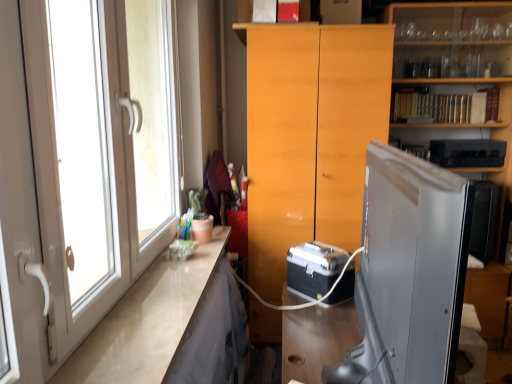
Question: Is metallic silver briefcase at center, which is counted as the 1th appliance, starting from the left, next to white glossy counter top at left?

Choices:
 (A) no
 (B) yes

Answer: (A)

Question: Is metallic silver briefcase at center, the second appliance from the back, aimed at white glossy counter top at left?

Choices:
 (A) no
 (B) yes

Answer: (A)

Question: Considering the relative sizes of metallic silver briefcase at center, acting as the 1th appliance starting from the front, and white glossy counter top at left in the image provided, is metallic silver briefcase at center, acting as the 1th appliance starting from the front, shorter than white glossy counter top at left?

Choices:
 (A) no
 (B) yes

Answer: (A)

Question: Can you confirm if metallic silver briefcase at center, acting as the 1th appliance starting from the front, is positioned to the left of white glossy counter top at left?

Choices:
 (A) no
 (B) yes

Answer: (A)

Question: From a real-world perspective, is metallic silver briefcase at center, the second appliance viewed from the right, physically above white glossy counter top at left?

Choices:
 (A) yes
 (B) no

Answer: (B)

Question: Considering the positions of light wood cabinet at center and white glossy door at left in the image, is light wood cabinet at center wider or thinner than white glossy door at left?

Choices:
 (A) thin
 (B) wide

Answer: (B)

Question: Considering their positions, is light wood cabinet at center located in front of or behind white glossy door at left?

Choices:
 (A) behind
 (B) front

Answer: (A)

Question: Is light wood cabinet at center bigger or smaller than white glossy door at left?

Choices:
 (A) big
 (B) small

Answer: (A)

Question: Do you think light wood cabinet at center is within white glossy door at left, or outside of it?

Choices:
 (A) outside
 (B) inside

Answer: (A)

Question: From the image's perspective, is white glossy door at left above or below black plastic microwave at upper right, acting as the 2th appliance starting from the bottom?

Choices:
 (A) below
 (B) above

Answer: (A)

Question: From a real-world perspective, relative to black plastic microwave at upper right, arranged as the 1th appliance when viewed from the back, is white glossy door at left vertically above or below?

Choices:
 (A) below
 (B) above

Answer: (B)

Question: Is point (24, 360) positioned closer to the camera than point (443, 142)?

Choices:
 (A) closer
 (B) farther

Answer: (A)

Question: Looking at their shapes, would you say white glossy door at left is wider or thinner than black plastic microwave at upper right, which ranks as the second appliance in front-to-back order?

Choices:
 (A) thin
 (B) wide

Answer: (A)

Question: In terms of width, does metallic silver briefcase at center, acting as the 1th appliance starting from the front, look wider or thinner when compared to black plastic microwave at upper right, the 2th appliance when ordered from left to right?

Choices:
 (A) wide
 (B) thin

Answer: (A)

Question: In the image, is metallic silver briefcase at center, the second appliance viewed from the right, positioned in front of or behind black plastic microwave at upper right, acting as the 2th appliance starting from the bottom?

Choices:
 (A) behind
 (B) front

Answer: (B)